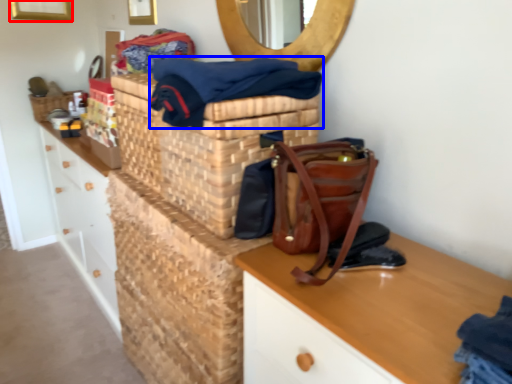
Question: Which object appears farthest to the camera in this image, picture frame (highlighted by a red box) or clothing (highlighted by a blue box)?

Choices:
 (A) picture frame
 (B) clothing

Answer: (A)